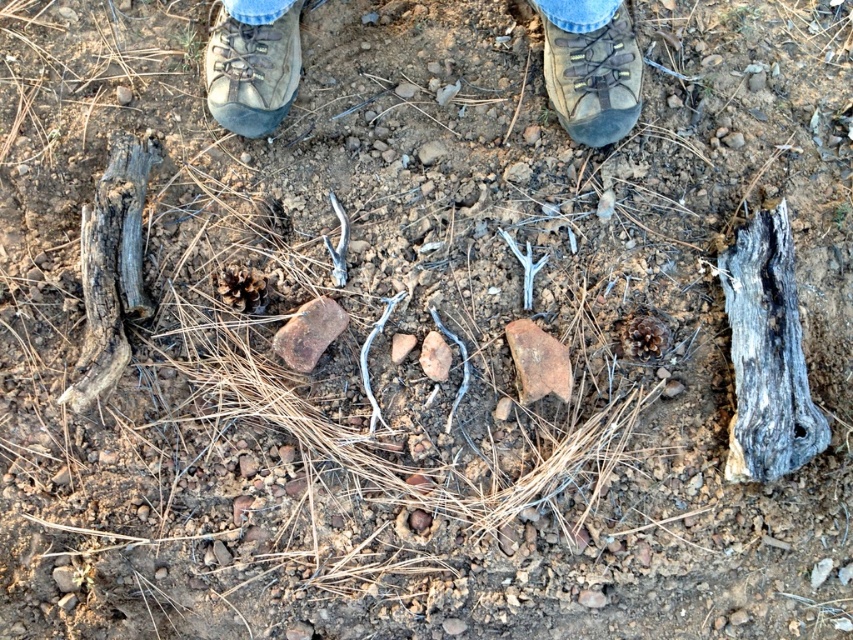
Does gray weathered log at left have a lesser width compared to brown leather shoe at upper center?

Correct, gray weathered log at left's width is less than brown leather shoe at upper center's.

Is point (123, 296) positioned in front of point (212, 90)?

Yes, point (123, 296) is closer to viewer.

Identify the location of gray weathered log at left. [x=111, y=268].

Which is more to the right, brown leather boot at upper center or jeans at center?

Positioned to the right is brown leather boot at upper center.

Who is shorter, brown leather boot at upper center or jeans at center?

jeans at center

This screenshot has width=853, height=640. I want to click on brown leather boot at upper center, so click(593, 77).

Between point (582, 134) and point (233, 68), which one is positioned in front?

Point (233, 68)

Between brown leather boots at center and brown leather shoe at upper center, which one has more height?

brown leather boots at center

Does point (637, 81) lie in front of point (216, 40)?

Yes, it is.

Identify the location of brown leather boots at center. This screenshot has height=640, width=853. (590, 67).